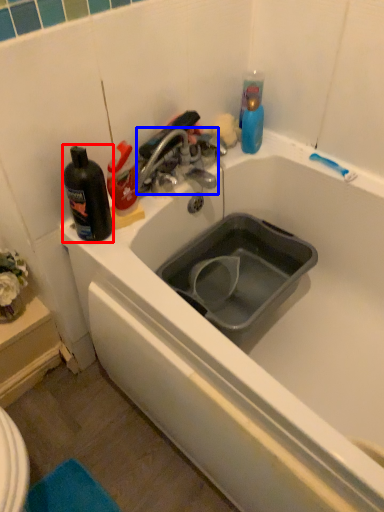
Question: Among these objects, which one is farthest to the camera, bottle (highlighted by a red box) or tap (highlighted by a blue box)?

Choices:
 (A) bottle
 (B) tap

Answer: (B)